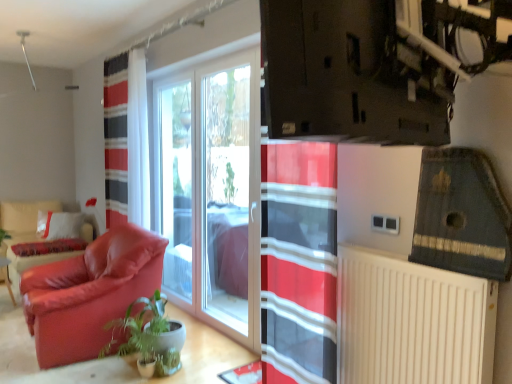
Describe the element at coordinates (26, 236) in the screenshot. I see `matte leather armchair at left` at that location.

From the picture: In order to face green glossy plant at lower left, should I rotate leftwards or rightwards?

It's best to rotate left around 15.672 degrees.

What do you see at coordinates (149, 337) in the screenshot? I see `green glossy plant at lower left` at bounding box center [149, 337].

Identify the location of white plastic radiator at lower right. (412, 321).

Find the location of a particular element. matte leather armchair at left is located at coordinates pyautogui.click(x=26, y=236).

Between point (144, 347) and point (245, 205), which one is positioned behind?

The point (245, 205) is farther.

Who is bigger, green glossy plant at lower left or transparent glass window at center?

Bigger between the two is transparent glass window at center.

Where is `window screen that is on the right side of green glossy plant at lower left`? window screen that is on the right side of green glossy plant at lower left is located at coordinates (226, 195).

Choose the correct answer: Is green glossy plant at lower left inside matte leather armchair at left or outside it?

green glossy plant at lower left is located beyond the bounds of matte leather armchair at left.

Considering the positions of objects green glossy plant at lower left and matte leather armchair at left in the image provided, who is more to the left, green glossy plant at lower left or matte leather armchair at left?

Positioned to the left is matte leather armchair at left.

From the image's perspective, is green glossy plant at lower left above or below matte leather armchair at left?

green glossy plant at lower left is situated lower than matte leather armchair at left in the image.

Which is closer, (153, 294) or (39, 201)?

The point (153, 294) is more forward.

This screenshot has height=384, width=512. In the image, there is a white plastic radiator at lower right. Identify the location of armchair below it (from a real-world perspective). (26, 236).

Which of these two, white plastic radiator at lower right or matte leather armchair at left, is thinner?

white plastic radiator at lower right is thinner.

Is white plastic radiator at lower right turned away from matte leather armchair at left?

No, white plastic radiator at lower right's orientation is not away from matte leather armchair at left.

Which of these two, green glossy plant at lower left or white plastic radiator at lower right, stands taller?

white plastic radiator at lower right is taller.

At what (x,y) coordinates should I click in order to perform the action: click on houseplant lying behind the white plastic radiator at lower right. Please return your answer as a coordinate pair (x, y). Looking at the image, I should click on (149, 337).

Is green glossy plant at lower left bigger than white plastic radiator at lower right?

Yes, green glossy plant at lower left is bigger than white plastic radiator at lower right.

Is the position of green glossy plant at lower left more distant than that of white plastic radiator at lower right?

Yes, it is.

This screenshot has width=512, height=384. In order to click on chair that is on the left side of green glossy plant at lower left in this screenshot , I will do `click(89, 293)`.

Based on their positions, is velvet red armchair at left located to the left or right of green glossy plant at lower left?

velvet red armchair at left is to the left of green glossy plant at lower left.

How much distance is there between velvet red armchair at left and green glossy plant at lower left?

velvet red armchair at left and green glossy plant at lower left are 37.46 centimeters apart from each other.

Who is smaller, velvet red armchair at left or green glossy plant at lower left?

green glossy plant at lower left is smaller.

From a real-world perspective, is white plastic radiator at lower right on green glossy plant at lower left?

Correct, in the physical world, white plastic radiator at lower right is higher than green glossy plant at lower left.

Is white plastic radiator at lower right not near green glossy plant at lower left?

white plastic radiator at lower right is far away from green glossy plant at lower left.

How far apart are white plastic radiator at lower right and green glossy plant at lower left?

5.26 feet.

Is white plastic radiator at lower right further to the viewer compared to green glossy plant at lower left?

No, the depth of white plastic radiator at lower right is less than that of green glossy plant at lower left.

Relative to velvet red armchair at left, is transparent glass window at center in front or behind?

transparent glass window at center is positioned farther from the viewer than velvet red armchair at left.

In the image, is transparent glass window at center on the left side or the right side of velvet red armchair at left?

transparent glass window at center is positioned on velvet red armchair at left's right side.

From the image's perspective, is transparent glass window at center located beneath velvet red armchair at left?

No.

Is velvet red armchair at left surrounded by transparent glass window at center?

That's incorrect, velvet red armchair at left is not inside transparent glass window at center.

Identify the location of houseplant located in front of the transparent glass window at center. This screenshot has height=384, width=512. (149, 337).

Find the location of a particular element. Image resolution: width=512 pixels, height=384 pixels. armchair that appears behind the green glossy plant at lower left is located at coordinates (26, 236).

Considering their positions, is white plastic radiator at lower right positioned further to velvet red armchair at left than matte leather armchair at left?

Among the two, matte leather armchair at left is located further to velvet red armchair at left.

From the image, which object appears to be farther from matte leather armchair at left, white plastic radiator at lower right or green glossy plant at lower left?

Based on the image, white plastic radiator at lower right appears to be further to matte leather armchair at left.

Looking at the image, which one is located further to velvet red armchair at left, green glossy plant at lower left or white plastic radiator at lower right?

white plastic radiator at lower right is positioned further to the anchor velvet red armchair at left.

When comparing their distances from velvet red armchair at left, does matte leather armchair at left or green glossy plant at lower left seem further?

The object further to velvet red armchair at left is matte leather armchair at left.

Estimate the real-world distances between objects in this image. Which object is closer to white plastic radiator at lower right, velvet red armchair at left or matte leather armchair at left?

velvet red armchair at left is closer to white plastic radiator at lower right.

Looking at the image, which one is located further to transparent glass window at center, white plastic radiator at lower right or green glossy plant at lower left?

white plastic radiator at lower right lies further to transparent glass window at center than the other object.

Looking at the image, which one is located further to transparent glass window at center, matte leather armchair at left or velvet red armchair at left?

Among the two, matte leather armchair at left is located further to transparent glass window at center.

Looking at the image, which one is located closer to velvet red armchair at left, green glossy plant at lower left or transparent glass window at center?

The object closer to velvet red armchair at left is green glossy plant at lower left.

The height and width of the screenshot is (384, 512). I want to click on houseplant between velvet red armchair at left and transparent glass window at center, so click(149, 337).

Identify the location of chair between matte leather armchair at left and white plastic radiator at lower right from left to right. (89, 293).

I want to click on houseplant between white plastic radiator at lower right and transparent glass window at center along the z-axis, so click(x=149, y=337).

Image resolution: width=512 pixels, height=384 pixels. Identify the location of chair located between matte leather armchair at left and transparent glass window at center in the left-right direction. (89, 293).